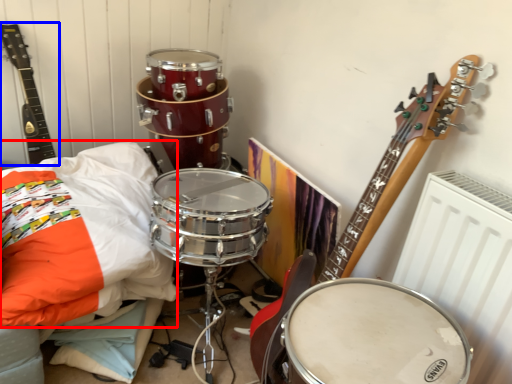
Question: Which point is closer to the camera, pillow (highlighted by a red box) or guitar (highlighted by a blue box)?

Choices:
 (A) pillow
 (B) guitar

Answer: (A)